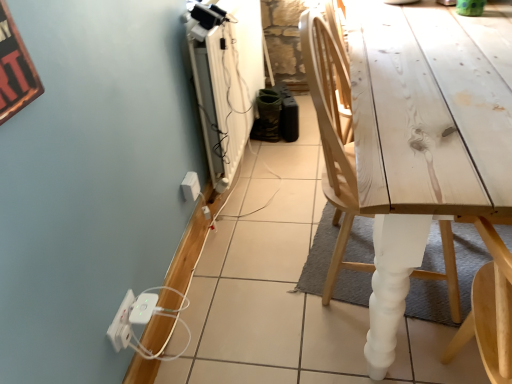
Where is `blank space to the left of natural wood chair at right`? This screenshot has width=512, height=384. blank space to the left of natural wood chair at right is located at coordinates point(261,278).